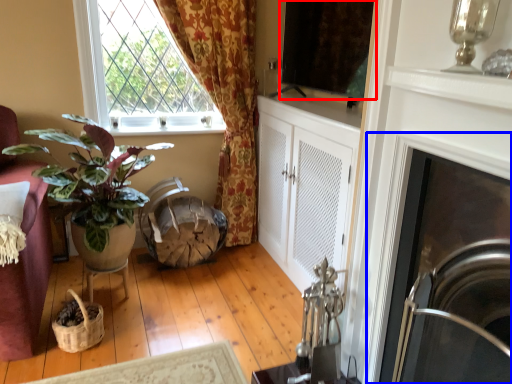
Question: Among these objects, which one is nearest to the camera, window screen (highlighted by a red box) or fireplace (highlighted by a blue box)?

Choices:
 (A) window screen
 (B) fireplace

Answer: (B)